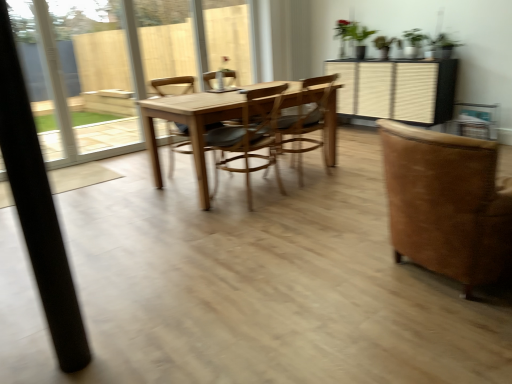
Where is `free spot in front of black matte pole at left`? This screenshot has height=384, width=512. free spot in front of black matte pole at left is located at coordinates (68, 376).